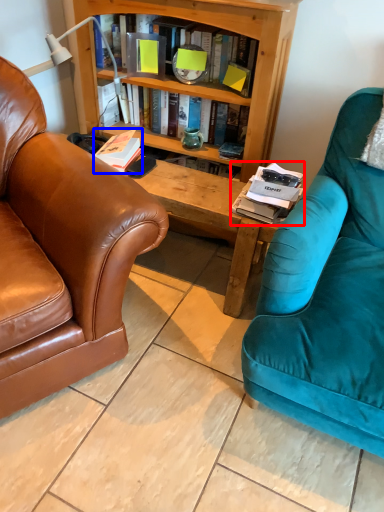
Question: Which point is further to the camera, magazine (highlighted by a red box) or book (highlighted by a blue box)?

Choices:
 (A) magazine
 (B) book

Answer: (B)